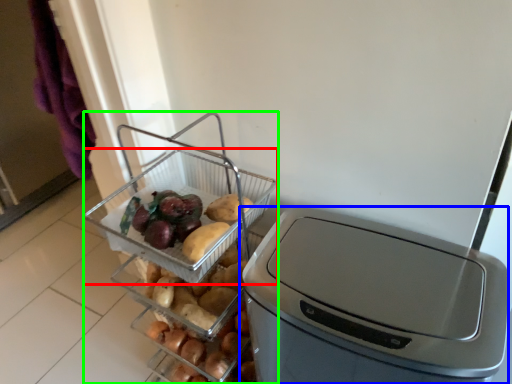
Question: Which object is positioned closest to basket (highlighted by a red box)? Select from home appliance (highlighted by a blue box) and appliance (highlighted by a green box).

Choices:
 (A) home appliance
 (B) appliance

Answer: (B)